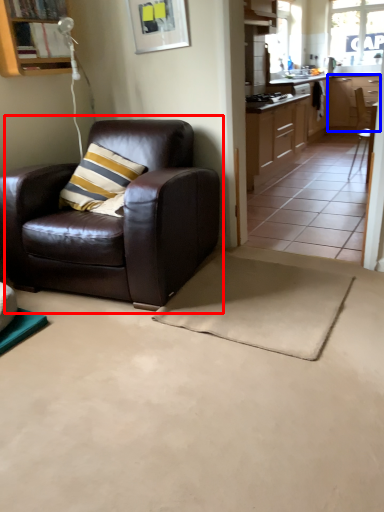
Question: Which of the following is the closest to the observer, chair (highlighted by a red box) or cabinetry (highlighted by a blue box)?

Choices:
 (A) chair
 (B) cabinetry

Answer: (A)